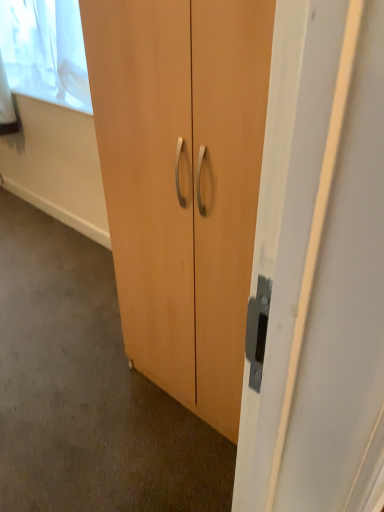
Question: From a real-world perspective, does matte wood cupboard at center sit lower than matte wood cabinet at center?

Choices:
 (A) no
 (B) yes

Answer: (A)

Question: Are matte wood cupboard at center and matte wood cabinet at center far apart?

Choices:
 (A) yes
 (B) no

Answer: (B)

Question: Considering the relative sizes of matte wood cupboard at center and matte wood cabinet at center in the image provided, is matte wood cupboard at center taller than matte wood cabinet at center?

Choices:
 (A) no
 (B) yes

Answer: (B)

Question: Does matte wood cupboard at center contain matte wood cabinet at center?

Choices:
 (A) no
 (B) yes

Answer: (A)

Question: Does matte wood cupboard at center lie behind matte wood cabinet at center?

Choices:
 (A) yes
 (B) no

Answer: (B)

Question: Can you confirm if matte wood cupboard at center is smaller than matte wood cabinet at center?

Choices:
 (A) no
 (B) yes

Answer: (A)

Question: From a real-world perspective, is white sheer curtain at upper left under matte wood cupboard at center?

Choices:
 (A) no
 (B) yes

Answer: (A)

Question: Can you confirm if white sheer curtain at upper left is bigger than matte wood cupboard at center?

Choices:
 (A) no
 (B) yes

Answer: (A)

Question: Is white sheer curtain at upper left smaller than matte wood cupboard at center?

Choices:
 (A) no
 (B) yes

Answer: (B)

Question: Is the depth of white sheer curtain at upper left less than that of matte wood cupboard at center?

Choices:
 (A) yes
 (B) no

Answer: (B)

Question: Considering the relative sizes of white sheer curtain at upper left and matte wood cupboard at center in the image provided, is white sheer curtain at upper left wider than matte wood cupboard at center?

Choices:
 (A) yes
 (B) no

Answer: (B)

Question: Is white sheer curtain at upper left further to camera compared to matte wood cupboard at center?

Choices:
 (A) no
 (B) yes

Answer: (B)

Question: Does white sheer curtain at upper left have a greater width compared to matte wood cabinet at center?

Choices:
 (A) no
 (B) yes

Answer: (A)